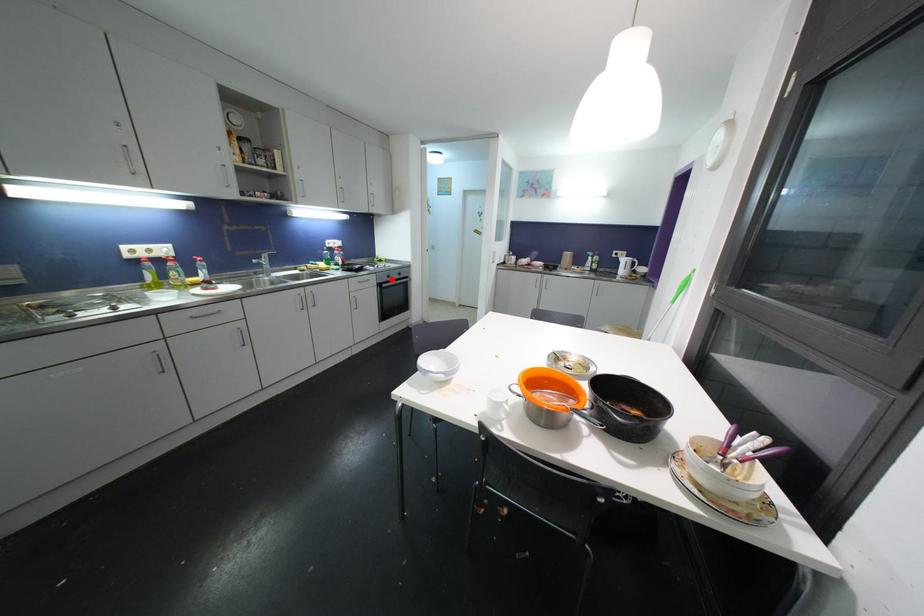
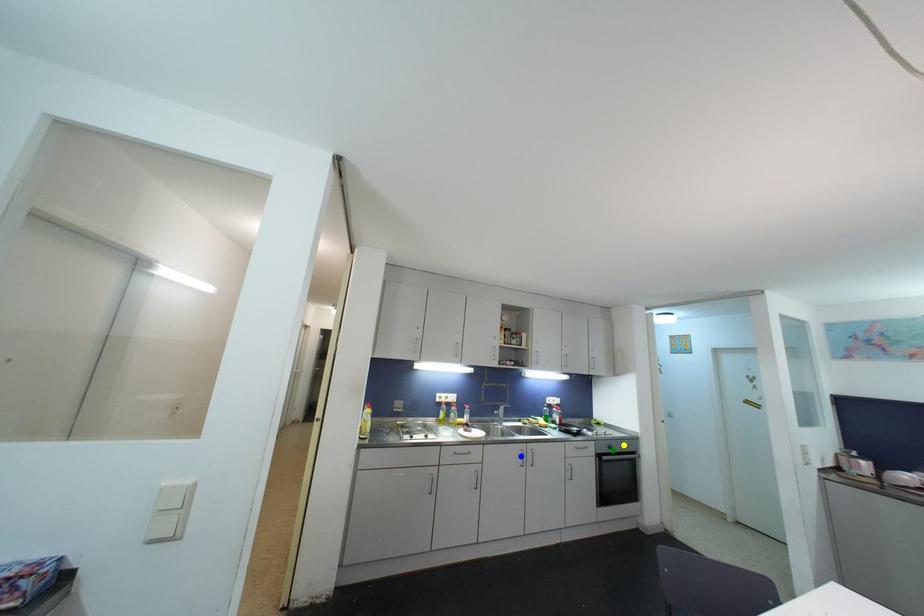
Question: I am providing you with two images of the same scene from different viewpoints. A red point is marked on the first image. You are given multiple points on the second image. Which point in image 2 is actually the same real-world point as the red point in image 1?

Choices:
 (A) blue point
 (B) yellow point
 (C) green point

Answer: (C)